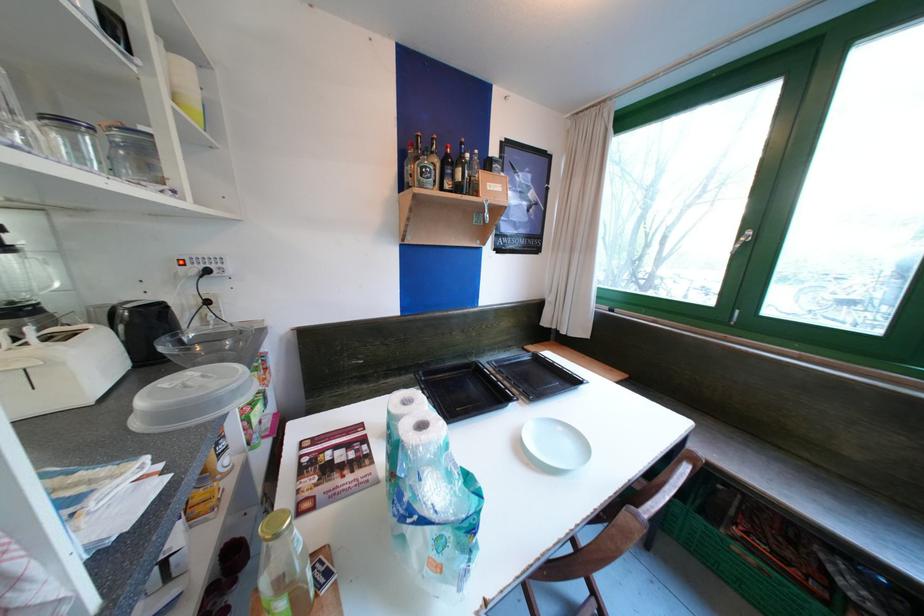
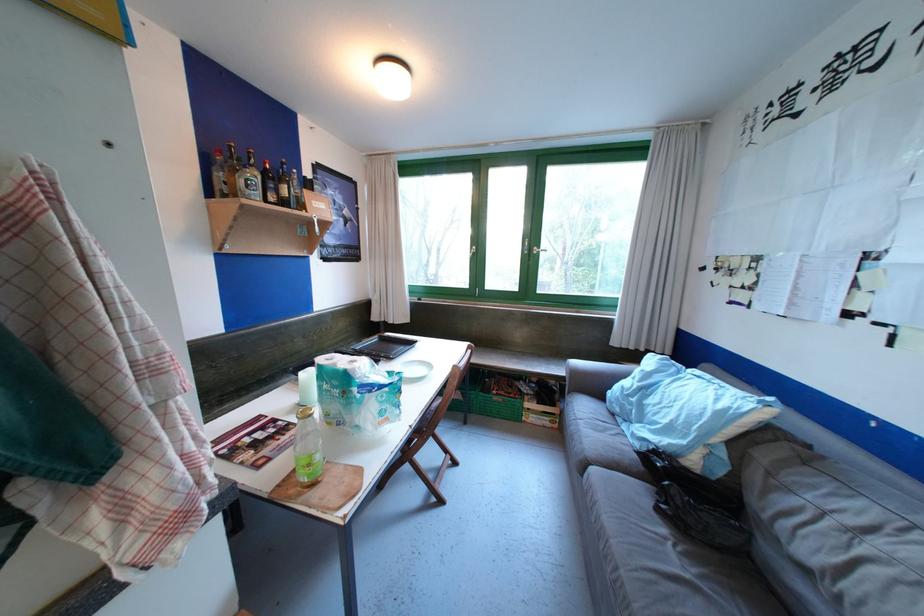
Question: I am providing you with two images of the same scene from different viewpoints. Which of the following objects are not visible in image2?

Choices:
 (A) blue pillow
 (B) purple chair surface
 (C) black baking tray
 (D) sofa armrest

Answer: (C)